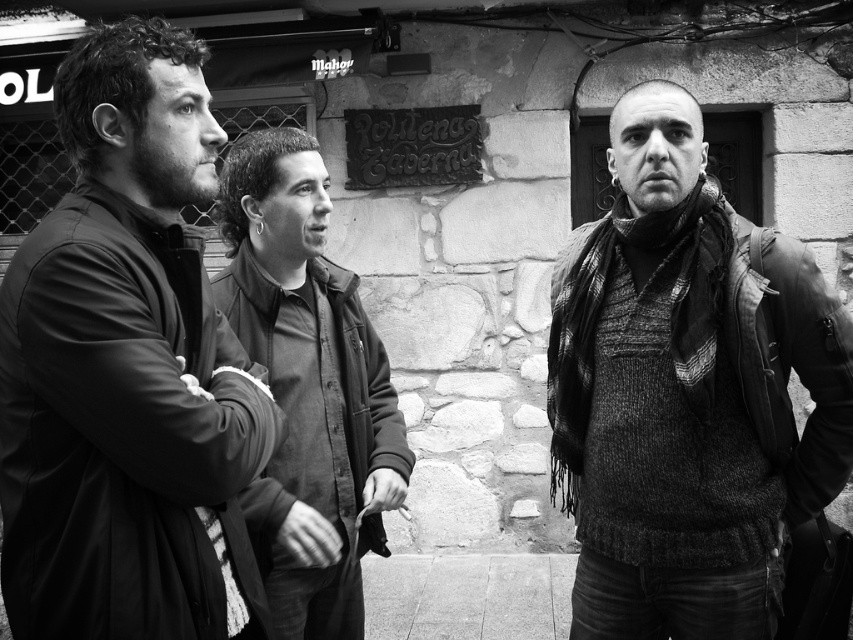
You are a fashion designer analyzing this image. You notice the matte black jacket at left and the knitted sweater at right. Which clothing item is covering part of the other?

The matte black jacket at left is positioned over the knitted sweater at right, so it is covering part of it.

You are a tailor who needs to determine which jacket requires more fabric for alterations. Based on the image, which jacket between the matte black jacket at left and the dark gray jacket at center would need more fabric due to its size?

The dark gray jacket at center requires more fabric because it is larger than the matte black jacket at left.